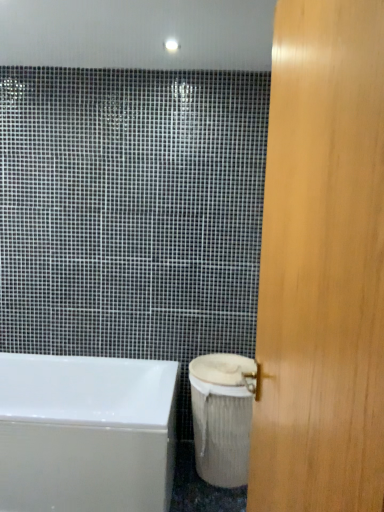
Question: Does wooden door at right have a larger size compared to white glossy bathtub at lower left?

Choices:
 (A) no
 (B) yes

Answer: (A)

Question: Considering the relative positions of wooden door at right and white glossy bathtub at lower left in the image provided, is wooden door at right behind white glossy bathtub at lower left?

Choices:
 (A) no
 (B) yes

Answer: (A)

Question: Can we say wooden door at right lies outside white glossy bathtub at lower left?

Choices:
 (A) yes
 (B) no

Answer: (A)

Question: Can you confirm if wooden door at right is shorter than white glossy bathtub at lower left?

Choices:
 (A) no
 (B) yes

Answer: (A)

Question: From a real-world perspective, does wooden door at right sit lower than white glossy bathtub at lower left?

Choices:
 (A) no
 (B) yes

Answer: (A)

Question: From the image's perspective, is wooden door at right beneath white glossy bathtub at lower left?

Choices:
 (A) no
 (B) yes

Answer: (A)

Question: Is white textured toilet bowl at lower right smaller than wooden door at right?

Choices:
 (A) yes
 (B) no

Answer: (A)

Question: Is white textured toilet bowl at lower right to the right of wooden door at right from the viewer's perspective?

Choices:
 (A) no
 (B) yes

Answer: (A)

Question: Is wooden door at right inside white textured toilet bowl at lower right?

Choices:
 (A) yes
 (B) no

Answer: (B)

Question: From the image's perspective, is white textured toilet bowl at lower right beneath wooden door at right?

Choices:
 (A) yes
 (B) no

Answer: (A)

Question: Is white textured toilet bowl at lower right to the left of wooden door at right from the viewer's perspective?

Choices:
 (A) yes
 (B) no

Answer: (A)

Question: Can you confirm if white textured toilet bowl at lower right is wider than wooden door at right?

Choices:
 (A) no
 (B) yes

Answer: (B)

Question: From the image's perspective, is wooden door at right on top of white textured toilet bowl at lower right?

Choices:
 (A) yes
 (B) no

Answer: (A)